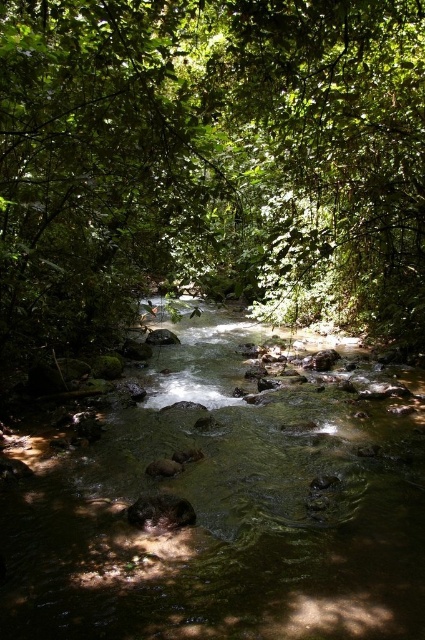
Who is more distant from viewer, (192, 164) or (348, 564)?

Point (192, 164)

Between green leafy tree at center and clear water at center, which one has more height?

green leafy tree at center

This screenshot has width=425, height=640. Identify the location of green leafy tree at center. (206, 156).